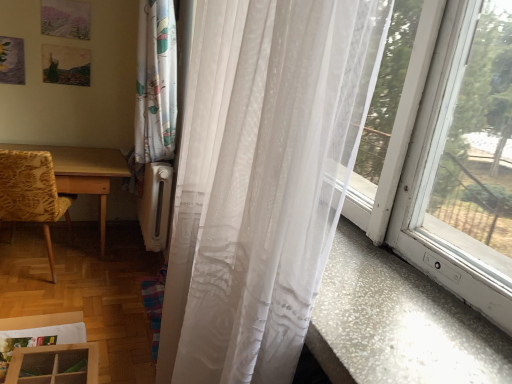
The height and width of the screenshot is (384, 512). Find the location of `vacant area located to the right-hand side of yellow floral fabric chair at left`. vacant area located to the right-hand side of yellow floral fabric chair at left is located at coordinates (93, 283).